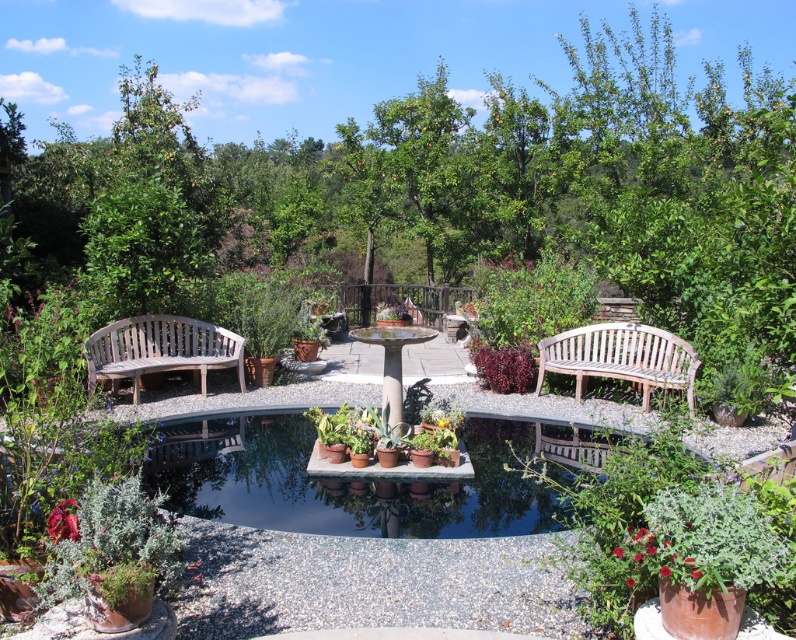
Question: Among these points, which one is farthest from the camera?

Choices:
 (A) (123, 538)
 (B) (123, 346)
 (C) (623, 362)
 (D) (354, 445)

Answer: (C)

Question: Which of the following is the closest to the observer?

Choices:
 (A) green matte potted plants at center
 (B) wooden bench at left

Answer: (A)

Question: Is green textured plant at lower left wider than wooden bench at left?

Choices:
 (A) no
 (B) yes

Answer: (A)

Question: From the image, what is the correct spatial relationship of green textured plant at lower left in relation to wooden bench at right?

Choices:
 (A) above
 (B) below

Answer: (B)

Question: Can you confirm if wooden bench at left is bigger than green matte potted plants at center?

Choices:
 (A) yes
 (B) no

Answer: (A)

Question: Which of the following is the farthest from the observer?

Choices:
 (A) wooden bench at right
 (B) green textured plant at lower left
 (C) wooden bench at left

Answer: (C)